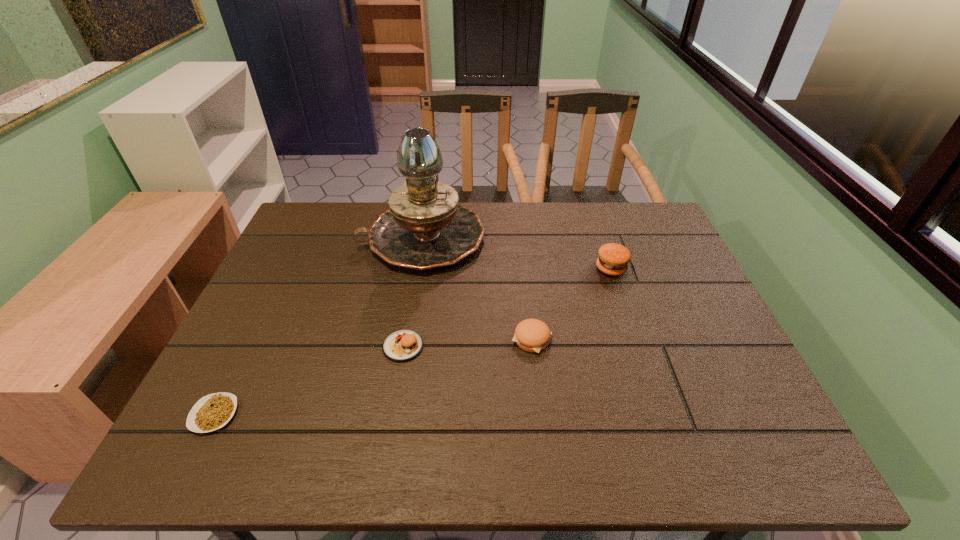
Find the location of a particular element. The image size is (960, 540). free region located on the front of the leftmost patty is located at coordinates (394, 405).

Locate an element on the screen. This screenshot has height=540, width=960. vacant region located 0.180m on the front of the fourth object from left to right is located at coordinates (541, 427).

The height and width of the screenshot is (540, 960). In order to click on vacant space located on the right of the nearest object in this screenshot , I will do `click(332, 414)`.

This screenshot has height=540, width=960. I want to click on object positioned at the far edge, so click(425, 228).

Locate an element on the screen. This screenshot has width=960, height=540. object located at the near edge is located at coordinates (213, 411).

Where is `object present at the left edge`? The width and height of the screenshot is (960, 540). object present at the left edge is located at coordinates (213, 411).

I want to click on object that is at the near left corner, so click(x=213, y=411).

At what (x,y) coordinates should I click in order to perform the action: click on blank space at the far edge of the desktop. Please return your answer as a coordinate pair (x, y). Looking at the image, I should click on (376, 213).

The image size is (960, 540). Identify the location of free space at the near edge of the desktop. (343, 449).

I want to click on vacant space at the left edge of the desktop, so click(x=302, y=261).